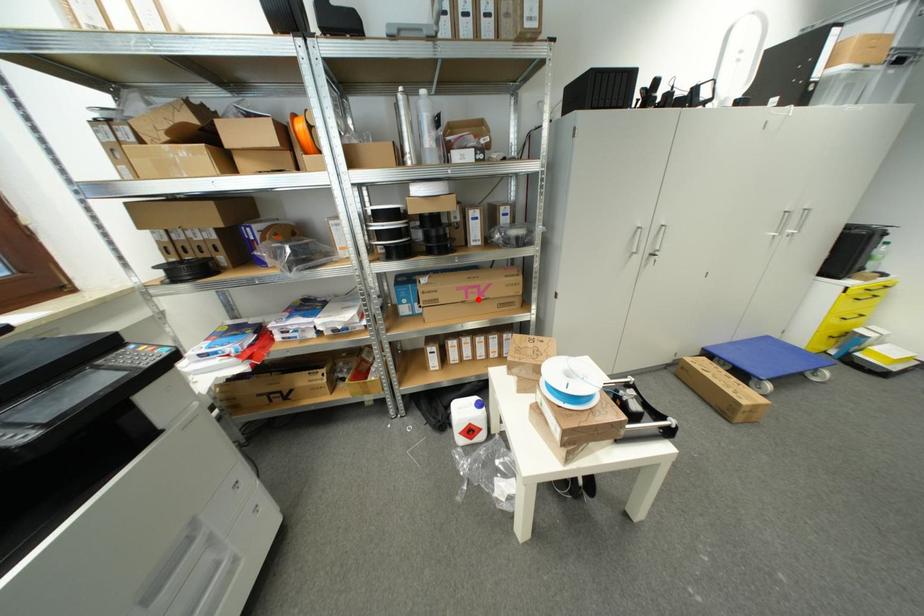
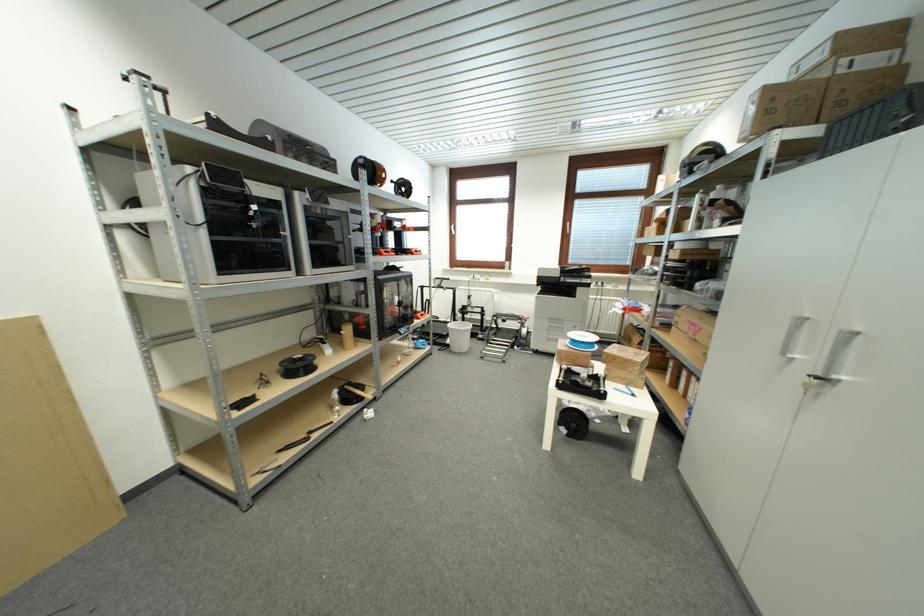
Where in the second image is the point corresponding to the highlighted location from the first image?

(696, 334)